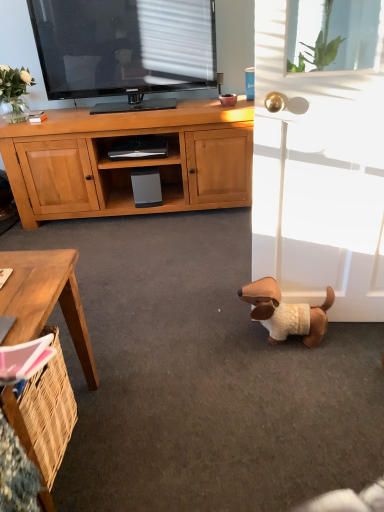
This screenshot has height=512, width=384. I want to click on vacant space underneath brown plush dog at lower right (from a real-world perspective), so click(289, 340).